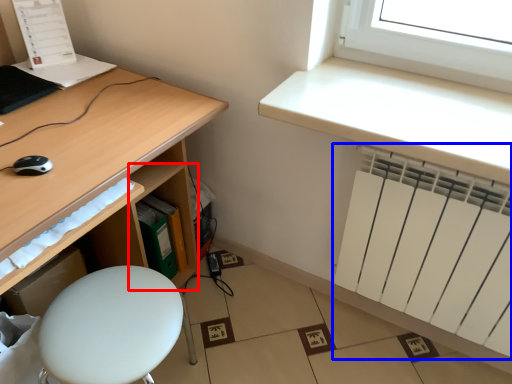
Question: Which point is closer to the camera, shelf (highlighted by a red box) or radiator (highlighted by a blue box)?

Choices:
 (A) shelf
 (B) radiator

Answer: (B)